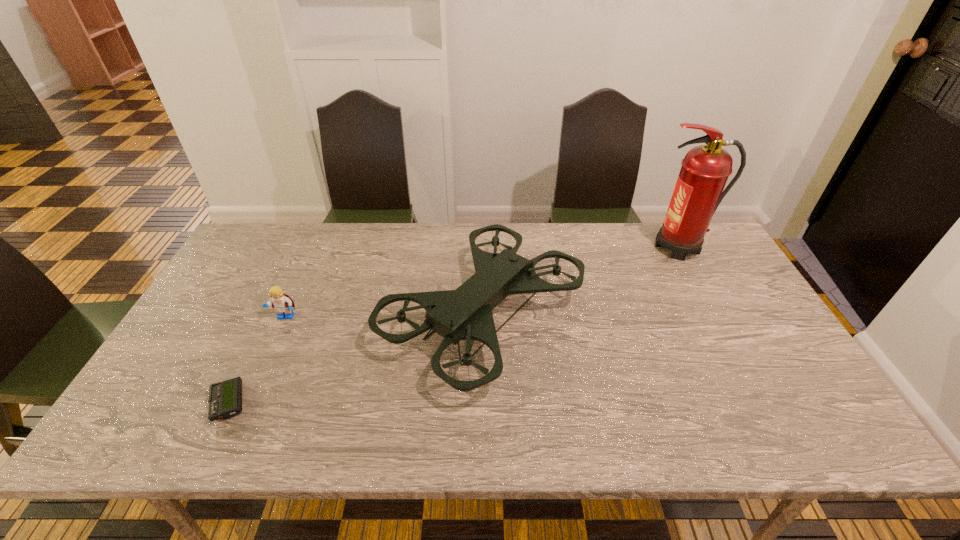
You are a GUI agent. You are given a task and a screenshot of the screen. Output one action in this format:
    pyautogui.click(x=<x>, y=<y>)
    Task: Click on the vacant space located 0.340m on the front-facing side of the Lego
    This screenshot has height=540, width=960.
    Given the screenshot: What is the action you would take?
    pyautogui.click(x=230, y=443)

This screenshot has height=540, width=960. In order to click on vacant space situated on the back of the shortest object in this screenshot , I will do `click(253, 350)`.

This screenshot has width=960, height=540. What are the coordinates of `fire extinguisher that is at the far edge` in the screenshot? It's located at (705, 169).

This screenshot has width=960, height=540. Identify the location of drone at the far edge. (464, 314).

Locate an element on the screen. Image resolution: width=960 pixels, height=540 pixels. drone located in the near edge section of the desktop is located at coordinates (464, 314).

Where is `beeper present at the near edge`? This screenshot has height=540, width=960. beeper present at the near edge is located at coordinates (225, 398).

What are the coordinates of `object that is at the left edge` in the screenshot? It's located at (225, 398).

Where is `object that is at the right edge`? The image size is (960, 540). object that is at the right edge is located at coordinates [705, 169].

The width and height of the screenshot is (960, 540). I want to click on object that is at the near left corner, so click(225, 398).

You are a GUI agent. You are given a task and a screenshot of the screen. Output one action in this format:
    pyautogui.click(x=<x>, y=<y>)
    Task: Click on the object at the far right corner
    
    Given the screenshot: What is the action you would take?
    pyautogui.click(x=705, y=169)